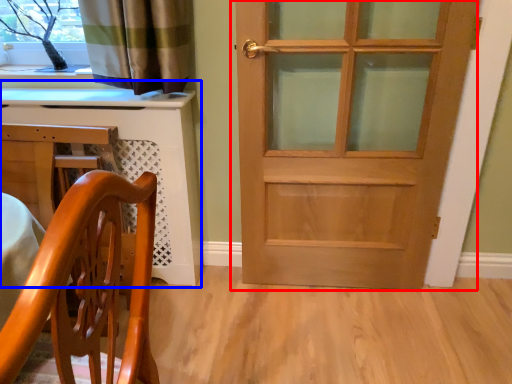
Question: Which of the following is the closest to the observer, door (highlighted by a red box) or computer desk (highlighted by a blue box)?

Choices:
 (A) door
 (B) computer desk

Answer: (A)